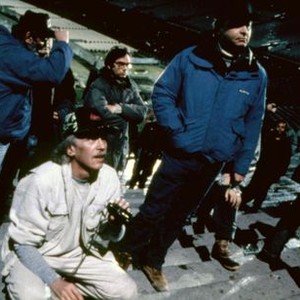
Locate an element on the screen. This screenshot has height=300, width=300. coat is located at coordinates (25, 64), (108, 87), (208, 107).